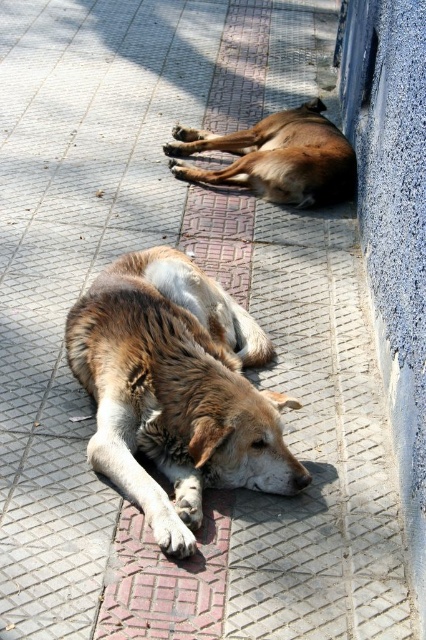
You are a photographer trying to capture both dogs in the scene. Since the brown fur dog at center and the brown furry dog at center are positioned close to each other, can you tell which one is closer to the ground?

The brown fur dog at center is closer to the ground because it is positioned below the brown furry dog at center.

You are a photographer trying to capture both dogs in a single photo. Since the dogs are positioned close to each other, will the brown fur dog at center block the view of the brown furry dog at center?

The brown fur dog at center is in front of the brown furry dog at center, so it will block the view of the brown furry dog at center.

You are a dog owner who wants to take a photo of both dogs. Since you are standing behind the brown fur dog at center and the brown furry dog at center, which dog should you move to the right to frame them properly?

The brown fur dog at center is to the left of brown furry dog at center. To frame them properly, you should move the brown fur dog at center to the right so they are positioned side by side.